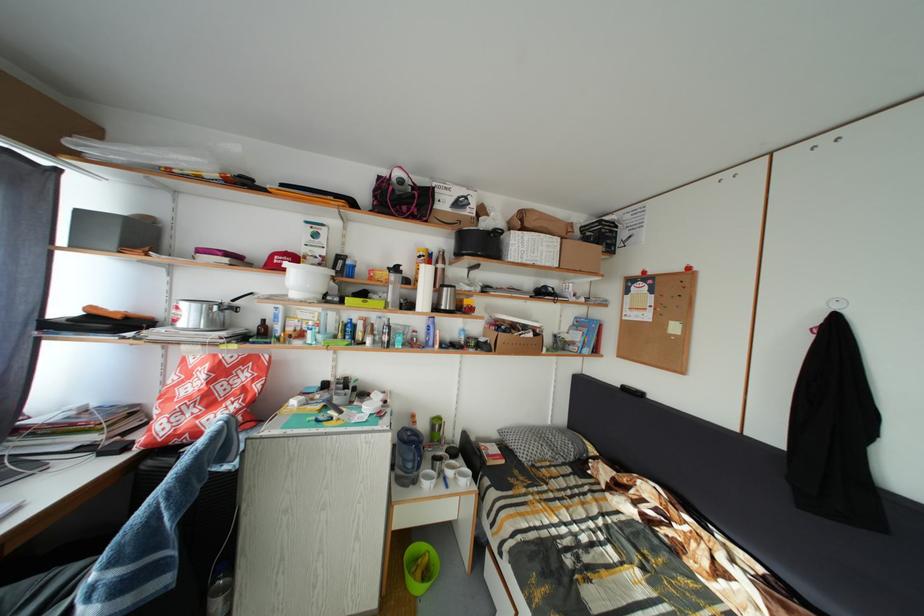
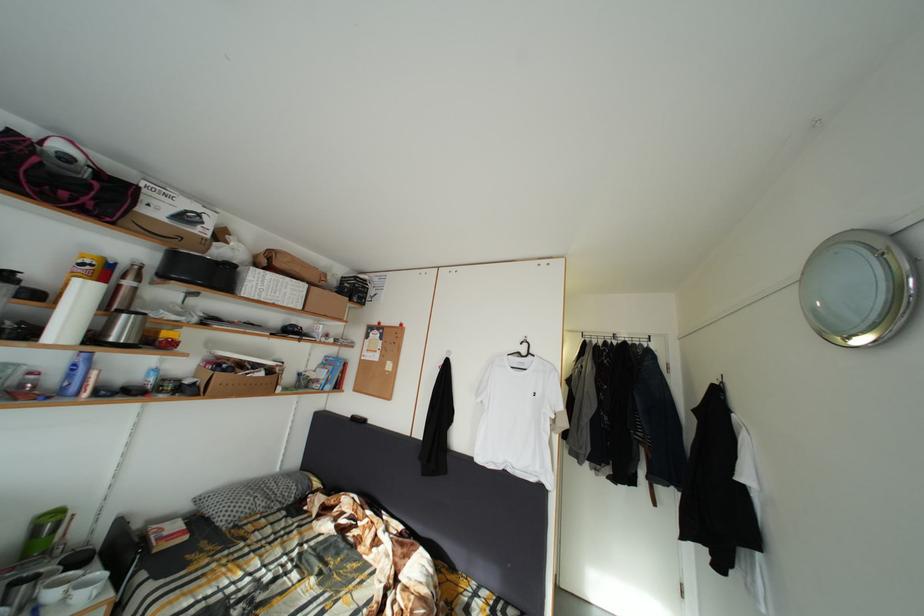
Where in the second image is the point corresponding to point (533, 334) from the first image?

(264, 373)